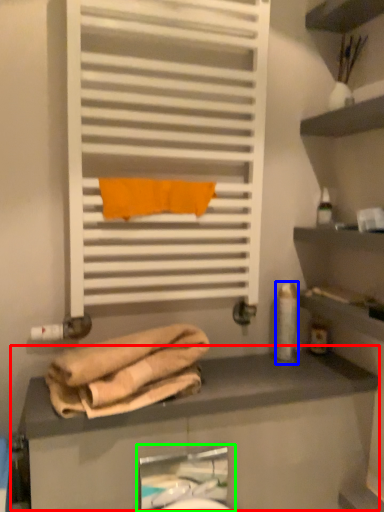
Question: Considering the real-world distances, which object is closest to counter (highlighted by a red box)? toiletry (highlighted by a blue box) or sink (highlighted by a green box).

Choices:
 (A) toiletry
 (B) sink

Answer: (A)